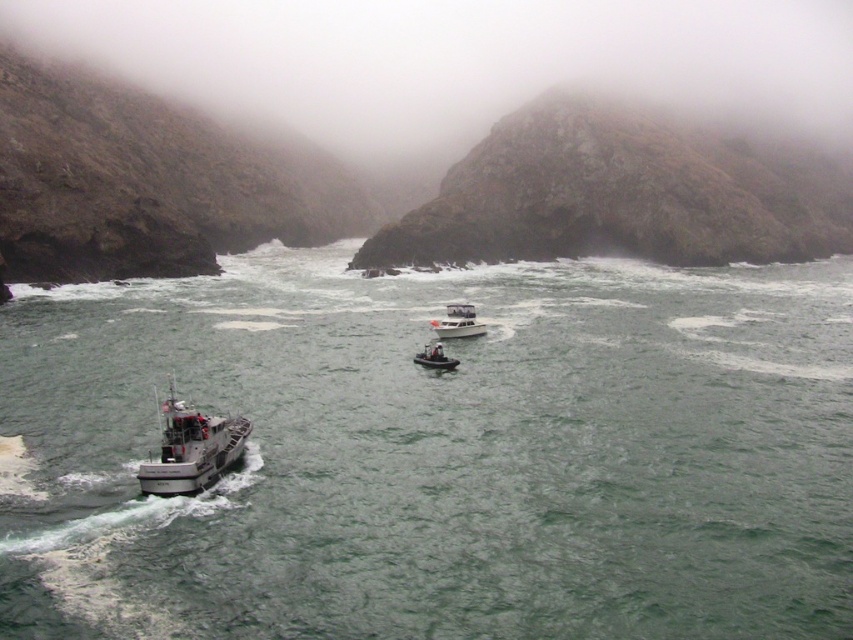
Question: Which of the following is the farthest from the observer?

Choices:
 (A) metallic gray boat at lower left
 (B) white matte boat at center

Answer: (B)

Question: Where is green matte water at center located in relation to white matte boat at center in the image?

Choices:
 (A) below
 (B) above

Answer: (A)

Question: Is metallic gray boat at lower left behind white matte boat at center?

Choices:
 (A) no
 (B) yes

Answer: (A)

Question: Considering the relative positions of white matte boat at center and white plastic dinghy at center in the image provided, where is white matte boat at center located with respect to white plastic dinghy at center?

Choices:
 (A) above
 (B) below

Answer: (A)

Question: Estimate the real-world distances between objects in this image. Which object is closer to the white matte boat at center?

Choices:
 (A) green matte water at center
 (B) metallic gray boat at lower left
 (C) white plastic dinghy at center

Answer: (C)

Question: Among these objects, which one is farthest from the camera?

Choices:
 (A) green matte water at center
 (B) metallic gray boat at lower left
 (C) white matte boat at center
 (D) white plastic dinghy at center

Answer: (C)